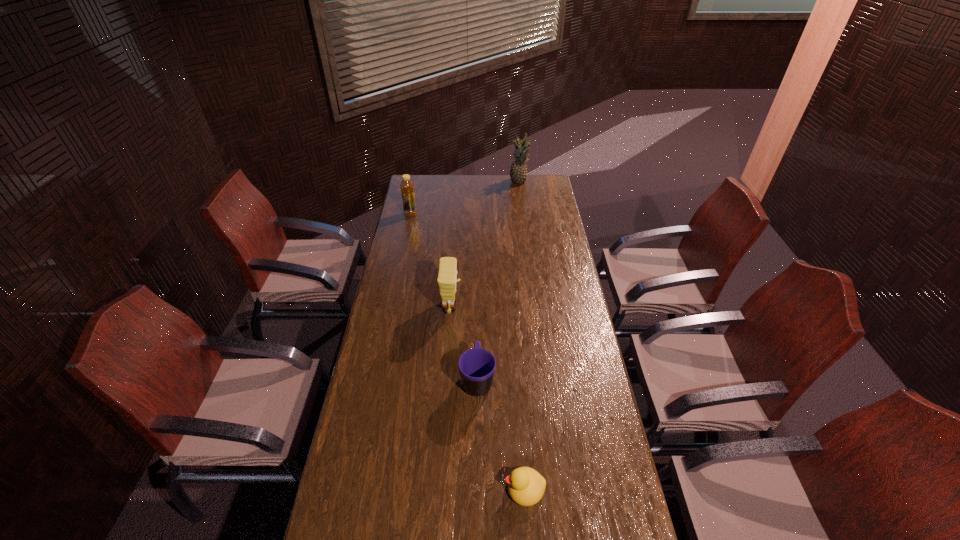
Image resolution: width=960 pixels, height=540 pixels. I want to click on free space between the second object from left to right and the fourth farthest object, so click(465, 343).

At what (x,y) coordinates should I click in order to perform the action: click on free space between the fourth object from right to left and the fourth farthest object. Please return your answer as a coordinate pair (x, y). Looking at the image, I should click on (465, 343).

You are a GUI agent. You are given a task and a screenshot of the screen. Output one action in this format:
    pyautogui.click(x=<x>, y=<y>)
    Task: Click on the unoccupied position between the sponge and the leftmost object
    The image size is (960, 540).
    Given the screenshot: What is the action you would take?
    pyautogui.click(x=431, y=260)

Find the location of a particular element. Image resolution: width=960 pixels, height=540 pixels. free point between the farthest object and the sponge is located at coordinates (485, 244).

At what (x,y) coordinates should I click in order to perform the action: click on free area in between the farthest object and the sponge. Please return your answer as a coordinate pair (x, y). The width and height of the screenshot is (960, 540). Looking at the image, I should click on (485, 244).

Find the location of `object that is the fourth closest to the second object from left to right`. object that is the fourth closest to the second object from left to right is located at coordinates (518, 173).

Identify which object is the fourth nearest to the duckling. Please provide its 2D coordinates. Your answer should be formatted as a tuple, i.e. [(x, y)], where the tuple contains the x and y coordinates of a point satisfying the conditions above.

[(518, 173)]

Locate an element on the screen. vacant position in the image that satisfies the following two spatial constraints: 1. on the back side of the tallest object; 2. on the right side of the bottle is located at coordinates (418, 182).

You are a GUI agent. You are given a task and a screenshot of the screen. Output one action in this format:
    pyautogui.click(x=<x>, y=<y>)
    Task: Click on the vacant space that satisfies the following two spatial constraints: 1. on the face of the fourth object from right to left; 2. with the handle on the side of the fourth farthest object
    This screenshot has width=960, height=540.
    Given the screenshot: What is the action you would take?
    pyautogui.click(x=446, y=380)

Find the location of a particular element. This screenshot has height=540, width=960. blank space that satisfies the following two spatial constraints: 1. with the handle on the side of the second nearest object; 2. on the face of the sponge is located at coordinates (477, 306).